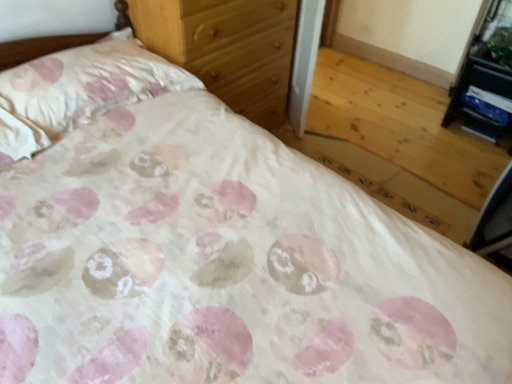
Question: Can you confirm if pink satin pillow at upper left is positioned to the left of wooden chest of drawers at upper center?

Choices:
 (A) yes
 (B) no

Answer: (A)

Question: Does pink satin pillow at upper left have a lesser height compared to wooden chest of drawers at upper center?

Choices:
 (A) yes
 (B) no

Answer: (A)

Question: Is pink satin pillow at upper left with wooden chest of drawers at upper center?

Choices:
 (A) no
 (B) yes

Answer: (A)

Question: From the image's perspective, would you say pink satin pillow at upper left is shown under wooden chest of drawers at upper center?

Choices:
 (A) no
 (B) yes

Answer: (B)

Question: Is pink satin pillow at upper left in front of wooden chest of drawers at upper center?

Choices:
 (A) yes
 (B) no

Answer: (A)

Question: Is pink satin pillow at upper left positioned with its back to wooden chest of drawers at upper center?

Choices:
 (A) no
 (B) yes

Answer: (A)

Question: Would you say pink satin pillow at upper left is outside black plastic vanity at upper right?

Choices:
 (A) yes
 (B) no

Answer: (A)

Question: From the image's perspective, does pink satin pillow at upper left appear higher than black plastic vanity at upper right?

Choices:
 (A) no
 (B) yes

Answer: (A)

Question: Is pink satin pillow at upper left beside black plastic vanity at upper right?

Choices:
 (A) yes
 (B) no

Answer: (B)

Question: Considering the relative sizes of pink satin pillow at upper left and black plastic vanity at upper right in the image provided, is pink satin pillow at upper left shorter than black plastic vanity at upper right?

Choices:
 (A) no
 (B) yes

Answer: (B)

Question: Is black plastic vanity at upper right surrounded by pink satin pillow at upper left?

Choices:
 (A) yes
 (B) no

Answer: (B)

Question: From a real-world perspective, is pink satin pillow at upper left located beneath black plastic vanity at upper right?

Choices:
 (A) no
 (B) yes

Answer: (A)

Question: Is the position of wooden chest of drawers at upper center less distant than that of black plastic vanity at upper right?

Choices:
 (A) yes
 (B) no

Answer: (A)